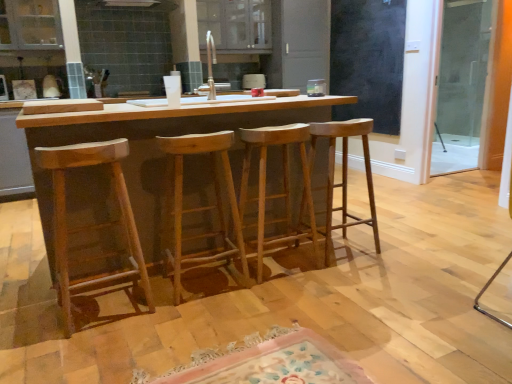
This screenshot has height=384, width=512. Identify the location of free space in front of natural wood stool at center, which is the second stool from right to left. (281, 299).